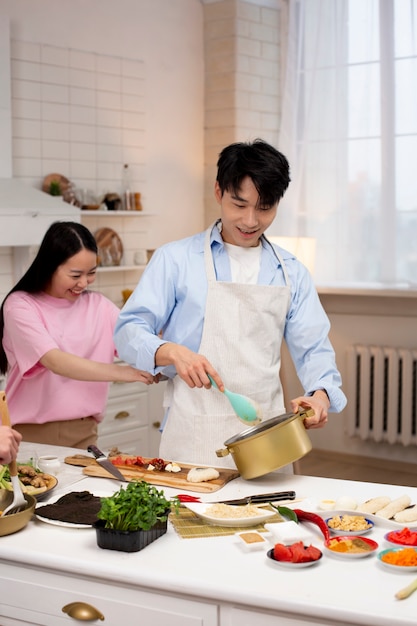
You are a GUI agent. You are given a task and a screenshot of the screen. Output one action in this format:
    pyautogui.click(x=<x>, y=<y>)
    Task: Click on the handles
    This screenshot has width=417, height=626.
    Given the screenshot: What is the action you would take?
    pyautogui.click(x=310, y=409)